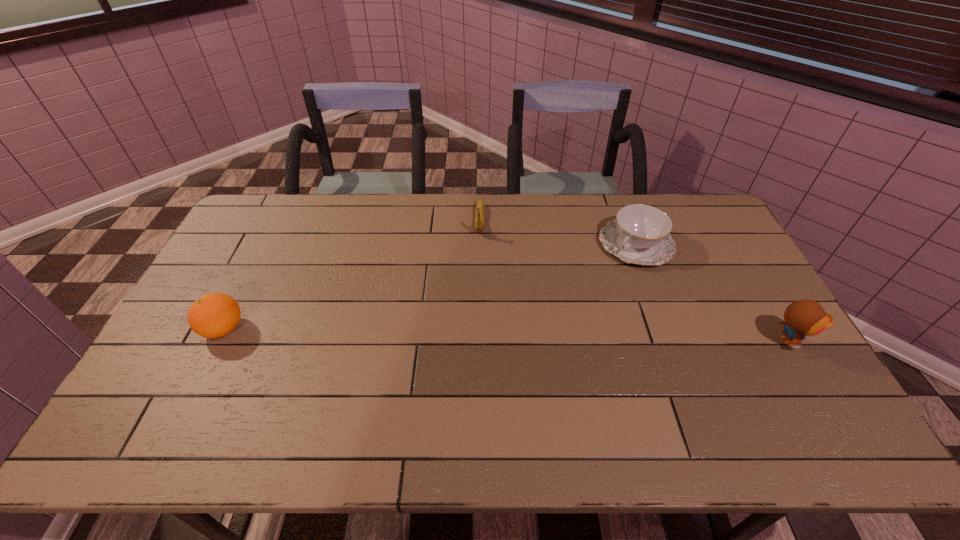
Find the location of `vacant space on the desktop that is between the orange and the duck and is positioned at the stem of the second object from left to right`. vacant space on the desktop that is between the orange and the duck and is positioned at the stem of the second object from left to right is located at coordinates (475, 334).

Find the location of a particular element. free spot on the desktop that is between the orange and the rightmost object and is positioned on the handle side of the chinaware is located at coordinates (x=543, y=335).